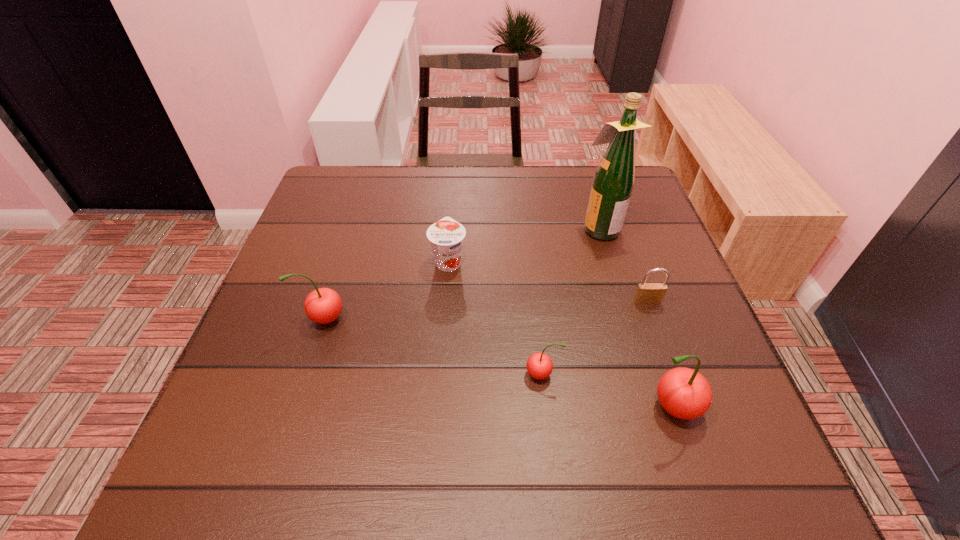
This screenshot has width=960, height=540. Find the location of `free space for an extra cherry to achieve even spacing`. free space for an extra cherry to achieve even spacing is located at coordinates (427, 345).